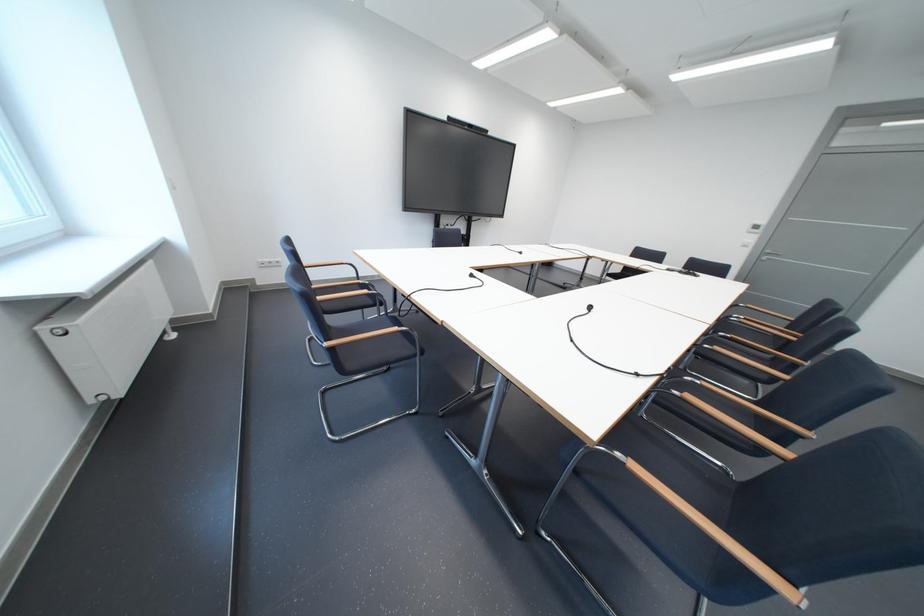
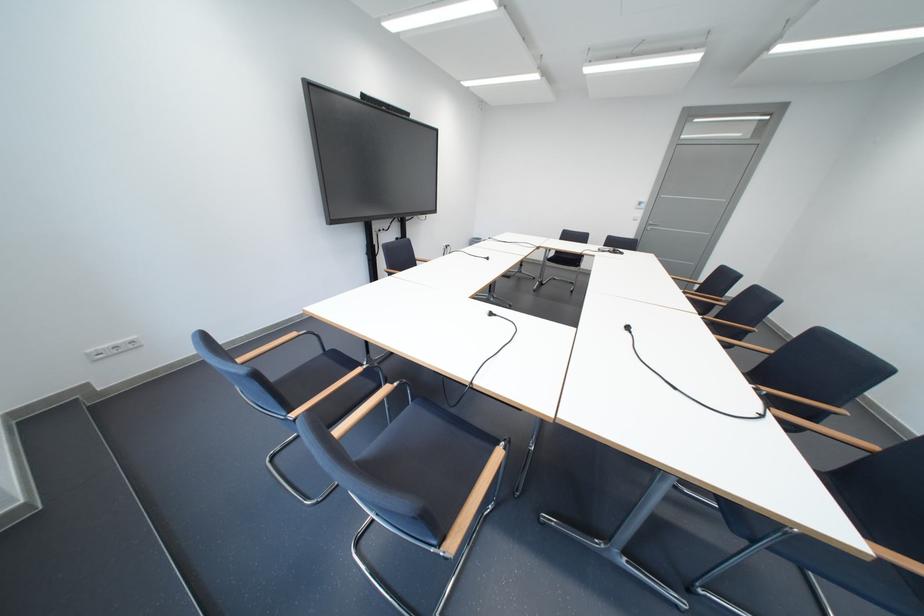
Question: Based on the continuous images, in which direction is the camera rotating? Reply with the corresponding letter.

Choices:
 (A) Left
 (B) Right
 (C) Up
 (D) Down

Answer: (B)